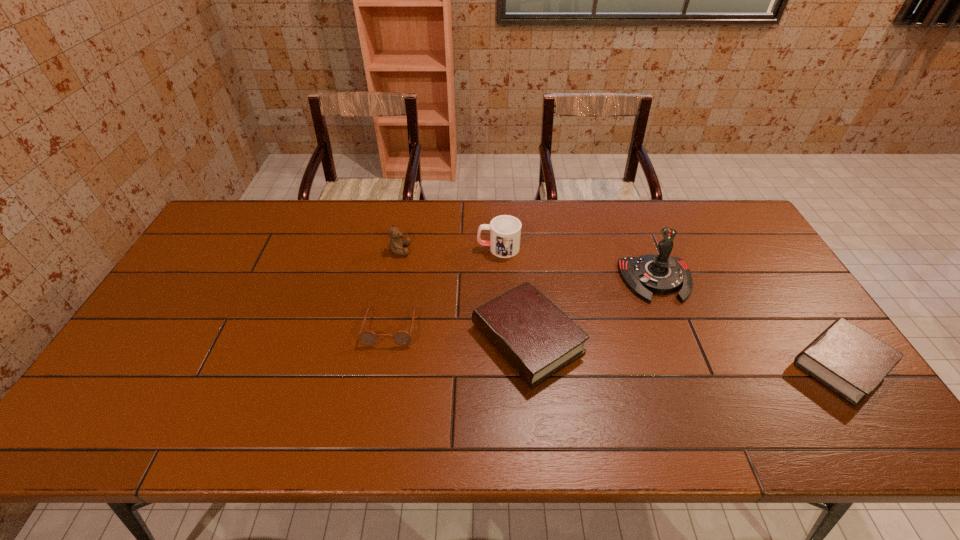
Find the location of `vacant space that's between the teddy bear and the shorter Bible`. vacant space that's between the teddy bear and the shorter Bible is located at coordinates (620, 307).

The height and width of the screenshot is (540, 960). Identify the location of blank region between the teddy bear and the shorter Bible. (620, 307).

At what (x,y) coordinates should I click in order to perform the action: click on free point between the spectacles and the left Bible. Please return your answer as a coordinate pair (x, y). Image resolution: width=960 pixels, height=540 pixels. Looking at the image, I should click on (459, 333).

Image resolution: width=960 pixels, height=540 pixels. I want to click on unoccupied position between the shorter Bible and the left Bible, so click(x=684, y=352).

Locate an element on the screen. Image resolution: width=960 pixels, height=540 pixels. free space that is in between the spectacles and the left Bible is located at coordinates (459, 333).

Find the location of a particular element. The image size is (960, 540). object that is the third nearest to the fourth tallest object is located at coordinates (505, 231).

What are the coordinates of `the second closest object to the spectacles` in the screenshot? It's located at (396, 245).

Locate an element on the screen. This screenshot has width=960, height=540. vacant position in the image that satisfies the following two spatial constraints: 1. on the front-facing side of the spectacles; 2. on the left side of the right Bible is located at coordinates (383, 365).

Image resolution: width=960 pixels, height=540 pixels. In order to click on free space that satisfies the following two spatial constraints: 1. on the side of the mug with the handle; 2. on the left side of the taller Bible in this screenshot , I will do `click(502, 339)`.

This screenshot has height=540, width=960. I want to click on free point that satisfies the following two spatial constraints: 1. on the front-facing side of the spectacles; 2. on the right side of the right Bible, so click(x=383, y=365).